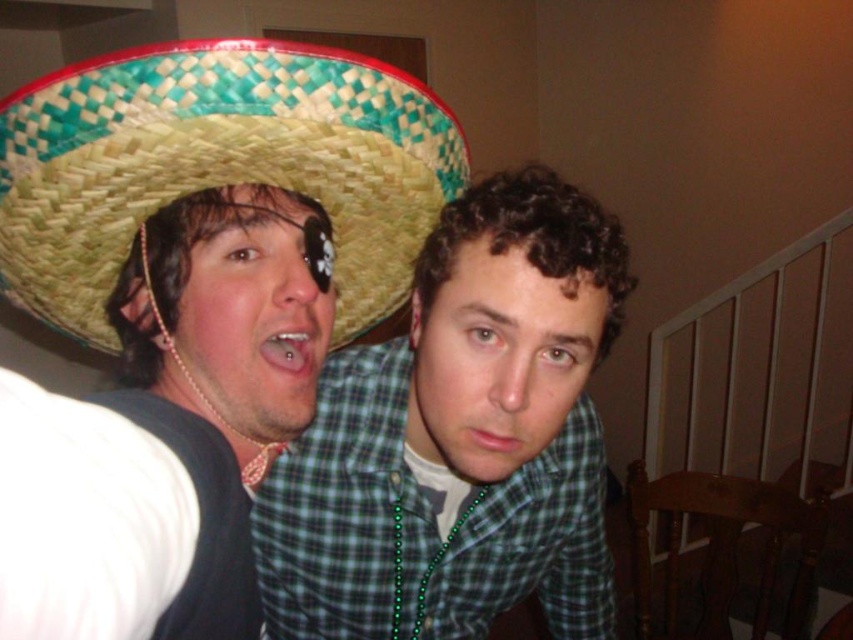
Question: Can you confirm if green plaid shirt at center is positioned to the right of woven straw sombrero at upper left?

Choices:
 (A) yes
 (B) no

Answer: (A)

Question: Can you confirm if green plaid shirt at center is smaller than woven straw sombrero at upper left?

Choices:
 (A) yes
 (B) no

Answer: (B)

Question: Is green plaid shirt at center below woven straw sombrero at upper left?

Choices:
 (A) no
 (B) yes

Answer: (B)

Question: Which object is farther from the camera taking this photo?

Choices:
 (A) woven straw sombrero at upper left
 (B) green plaid shirt at center

Answer: (B)

Question: Which object is farther from the camera taking this photo?

Choices:
 (A) green plaid shirt at center
 (B) woven straw sombrero at upper left

Answer: (A)

Question: Which object appears farthest from the camera in this image?

Choices:
 (A) woven straw sombrero at upper left
 (B) green plaid shirt at center

Answer: (B)